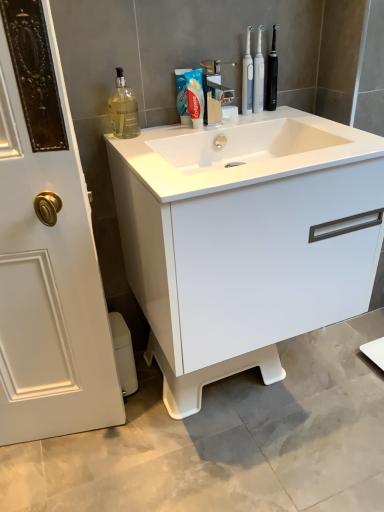
Where is `free space in front of matte white electric toothbrushes at upper center, which ranks as the first toiletry in left-to-right order`? The height and width of the screenshot is (512, 384). free space in front of matte white electric toothbrushes at upper center, which ranks as the first toiletry in left-to-right order is located at coordinates (269, 119).